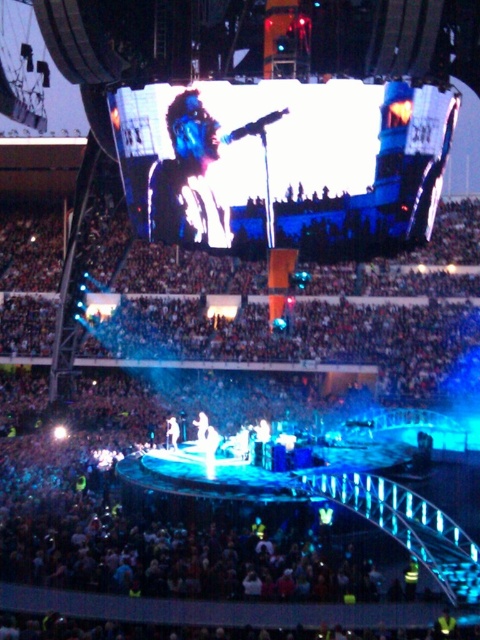
Can you confirm if matte black face at upper center is bigger than shiny silver microphone at center?

Yes.

Is point (180, 99) closer to viewer compared to point (178, 424)?

That is True.

Does point (168, 216) come in front of point (171, 428)?

That is True.

The image size is (480, 640). Identify the location of matte black face at upper center. (189, 177).